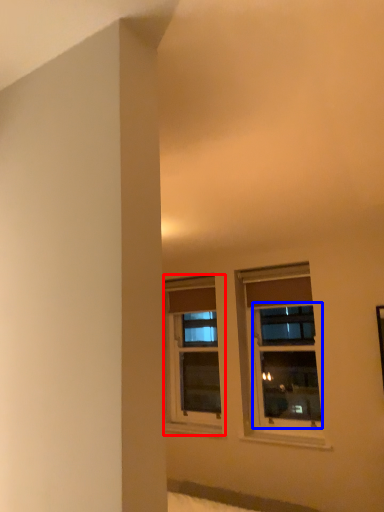
Question: Which point is closer to the camera, window (highlighted by a red box) or window (highlighted by a blue box)?

Choices:
 (A) window
 (B) window

Answer: (B)